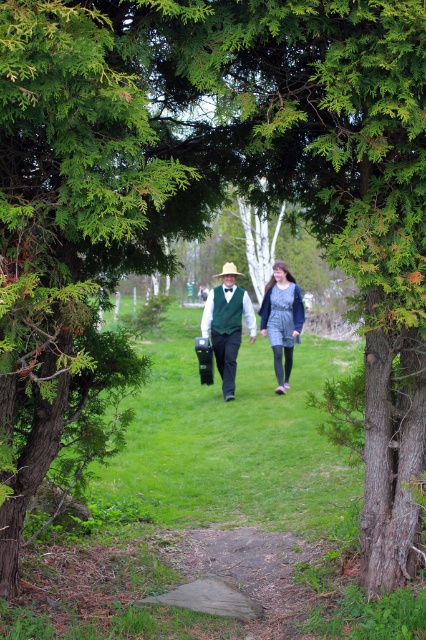
You are standing at point (66, 218) in the scene. What object is located exactly at your current position?

The green textured tree at center is located exactly at point (66, 218).

You are a photographer trying to capture a clear shot of the denim dress at center without the matte green vest at center blocking it. What adjustment should you make to your camera angle?

The matte green vest at center is positioned over the denim dress at center, so you should lower your camera angle to avoid the vest blocking the view of the dress.